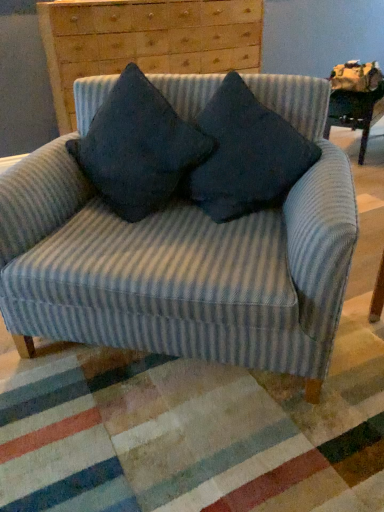
The width and height of the screenshot is (384, 512). I want to click on blue striped fabric chair at center, so click(x=184, y=259).

This screenshot has height=512, width=384. Describe the element at coordinates (145, 40) in the screenshot. I see `wooden chest of drawers at upper center` at that location.

Locate an element on the screen. The width and height of the screenshot is (384, 512). dark blue fabric pillow at center, which is counted as the first pillow, starting from the left is located at coordinates (138, 148).

Which object is further away from the camera, wooden chest of drawers at upper center or dark blue fabric pillow at center, which is the 1th pillow in right-to-left order?

wooden chest of drawers at upper center is behind.

From the image's perspective, is wooden chest of drawers at upper center located above dark blue fabric pillow at center, positioned as the 2th pillow in left-to-right order?

Correct, wooden chest of drawers at upper center appears higher than dark blue fabric pillow at center, positioned as the 2th pillow in left-to-right order, in the image.

Is wooden chest of drawers at upper center facing towards dark blue fabric pillow at center, positioned as the 2th pillow in left-to-right order?

Yes, wooden chest of drawers at upper center is aimed at dark blue fabric pillow at center, positioned as the 2th pillow in left-to-right order.

From the image's perspective, which is above, wooden chest of drawers at upper center or blue striped fabric chair at center?

wooden chest of drawers at upper center, from the image's perspective.

Visually, is wooden chest of drawers at upper center positioned to the left or to the right of blue striped fabric chair at center?

Based on their positions, wooden chest of drawers at upper center is located to the left of blue striped fabric chair at center.

Considering the relative sizes of wooden chest of drawers at upper center and blue striped fabric chair at center in the image provided, is wooden chest of drawers at upper center wider than blue striped fabric chair at center?

Incorrect, the width of wooden chest of drawers at upper center does not surpass that of blue striped fabric chair at center.

Can you tell me how much wooden chest of drawers at upper center and blue striped fabric chair at center differ in facing direction?

The angle between the facing direction of wooden chest of drawers at upper center and the facing direction of blue striped fabric chair at center is 40.5 degrees.

How much distance is there between dark blue fabric pillow at center, the 2th pillow viewed from the right, and blue striped fabric chair at center?

dark blue fabric pillow at center, the 2th pillow viewed from the right, and blue striped fabric chair at center are 9.29 inches apart from each other.

Is point (147, 205) closer or farther from the camera than point (42, 224)?

Point (147, 205) is farther from the camera than point (42, 224).

From a real-world perspective, relative to blue striped fabric chair at center, is dark blue fabric pillow at center, which is counted as the first pillow, starting from the left, vertically above or below?

From a real-world perspective, dark blue fabric pillow at center, which is counted as the first pillow, starting from the left, is physically above blue striped fabric chair at center.

Between dark blue fabric pillow at center, which is counted as the first pillow, starting from the left, and blue striped fabric chair at center, which one appears on the left side from the viewer's perspective?

From the viewer's perspective, dark blue fabric pillow at center, which is counted as the first pillow, starting from the left, appears more on the left side.

Can you confirm if blue striped fabric chair at center is bigger than dark blue fabric pillow at center, which is counted as the first pillow, starting from the left?

Yes, blue striped fabric chair at center is bigger than dark blue fabric pillow at center, which is counted as the first pillow, starting from the left.

Considering the positions of objects blue striped fabric chair at center and dark blue fabric pillow at center, which is counted as the first pillow, starting from the left, in the image provided, who is more to the right, blue striped fabric chair at center or dark blue fabric pillow at center, which is counted as the first pillow, starting from the left,?

Positioned to the right is blue striped fabric chair at center.

Can you confirm if blue striped fabric chair at center is shorter than dark blue fabric pillow at center, which is counted as the first pillow, starting from the left?

Incorrect, the height of blue striped fabric chair at center does not fall short of that of dark blue fabric pillow at center, which is counted as the first pillow, starting from the left.

Considering the positions of points (311, 283) and (187, 127), is point (311, 283) farther from camera compared to point (187, 127)?

No, it is not.

From a real-world perspective, is dark blue fabric pillow at center, the 2th pillow viewed from the right, positioned above or below wooden chest of drawers at upper center?

From a real-world perspective, dark blue fabric pillow at center, the 2th pillow viewed from the right, is physically below wooden chest of drawers at upper center.

Which object is positioned more to the right, dark blue fabric pillow at center, the 2th pillow viewed from the right, or wooden chest of drawers at upper center?

dark blue fabric pillow at center, the 2th pillow viewed from the right.

From the image's perspective, is dark blue fabric pillow at center, the 2th pillow viewed from the right, located beneath wooden chest of drawers at upper center?

Correct, dark blue fabric pillow at center, the 2th pillow viewed from the right, appears lower than wooden chest of drawers at upper center in the image.

I want to click on chest of drawers on the left side of dark blue fabric pillow at center, the 2th pillow viewed from the right, so click(x=145, y=40).

Considering the sizes of objects blue striped fabric chair at center and wooden chest of drawers at upper center in the image provided, who is thinner, blue striped fabric chair at center or wooden chest of drawers at upper center?

With smaller width is wooden chest of drawers at upper center.

From a real-world perspective, is blue striped fabric chair at center below wooden chest of drawers at upper center?

Indeed, from a real-world perspective, blue striped fabric chair at center is positioned beneath wooden chest of drawers at upper center.

Between blue striped fabric chair at center and wooden chest of drawers at upper center, which one has less height?

wooden chest of drawers at upper center is shorter.

Who is more distant, dark blue fabric pillow at center, which is the 1th pillow in right-to-left order, or wooden chest of drawers at upper center?

wooden chest of drawers at upper center.

From a real-world perspective, who is located lower, dark blue fabric pillow at center, positioned as the 2th pillow in left-to-right order, or wooden chest of drawers at upper center?

dark blue fabric pillow at center, positioned as the 2th pillow in left-to-right order.

You are a GUI agent. You are given a task and a screenshot of the screen. Output one action in this format:
    pyautogui.click(x=<x>, y=<y>)
    Task: Click on the pillow that is the 2nd object located below the wooden chest of drawers at upper center (from the image's perspective)
    The height and width of the screenshot is (512, 384).
    Given the screenshot: What is the action you would take?
    pyautogui.click(x=245, y=155)

Find the location of a particular element. chest of drawers that is on the left side of blue striped fabric chair at center is located at coordinates (145, 40).

Estimate the real-world distances between objects in this image. Which object is closer to wooden chest of drawers at upper center, dark blue fabric pillow at center, the 2th pillow viewed from the right, or dark blue fabric pillow at center, positioned as the 2th pillow in left-to-right order?

Among the two, dark blue fabric pillow at center, the 2th pillow viewed from the right, is located nearer to wooden chest of drawers at upper center.

From the image, which object appears to be farther from wooden chest of drawers at upper center, dark blue fabric pillow at center, which is the 1th pillow in right-to-left order, or blue striped fabric chair at center?

The object further to wooden chest of drawers at upper center is dark blue fabric pillow at center, which is the 1th pillow in right-to-left order.

From the image, which object appears to be nearer to dark blue fabric pillow at center, positioned as the 2th pillow in left-to-right order, dark blue fabric pillow at center, the 2th pillow viewed from the right, or blue striped fabric chair at center?

dark blue fabric pillow at center, the 2th pillow viewed from the right, is positioned closer to the anchor dark blue fabric pillow at center, positioned as the 2th pillow in left-to-right order.

Based on their spatial positions, is blue striped fabric chair at center or wooden chest of drawers at upper center closer to dark blue fabric pillow at center, the 2th pillow viewed from the right?

The object closer to dark blue fabric pillow at center, the 2th pillow viewed from the right, is blue striped fabric chair at center.

From the image, which object appears to be farther from wooden chest of drawers at upper center, blue striped fabric chair at center or dark blue fabric pillow at center, the 2th pillow viewed from the right?

→ blue striped fabric chair at center lies further to wooden chest of drawers at upper center than the other object.

When comparing their distances from dark blue fabric pillow at center, which is counted as the first pillow, starting from the left, does dark blue fabric pillow at center, which is the 1th pillow in right-to-left order, or wooden chest of drawers at upper center seem further?

wooden chest of drawers at upper center is positioned further to the anchor dark blue fabric pillow at center, which is counted as the first pillow, starting from the left.

Which object lies further to the anchor point wooden chest of drawers at upper center, dark blue fabric pillow at center, positioned as the 2th pillow in left-to-right order, or dark blue fabric pillow at center, the 2th pillow viewed from the right?

Among the two, dark blue fabric pillow at center, positioned as the 2th pillow in left-to-right order, is located further to wooden chest of drawers at upper center.

Based on their spatial positions, is dark blue fabric pillow at center, which is the 1th pillow in right-to-left order, or dark blue fabric pillow at center, the 2th pillow viewed from the right, closer to blue striped fabric chair at center?

dark blue fabric pillow at center, the 2th pillow viewed from the right.

You are a GUI agent. You are given a task and a screenshot of the screen. Output one action in this format:
    pyautogui.click(x=<x>, y=<y>)
    Task: Click on the pillow between dark blue fabric pillow at center, which is the 1th pillow in right-to-left order, and wooden chest of drawers at upper center from front to back
    The image size is (384, 512).
    Given the screenshot: What is the action you would take?
    pyautogui.click(x=138, y=148)

The image size is (384, 512). Find the location of `pillow between blue striped fabric chair at center and dark blue fabric pillow at center, which is counted as the first pillow, starting from the left, from front to back`. pillow between blue striped fabric chair at center and dark blue fabric pillow at center, which is counted as the first pillow, starting from the left, from front to back is located at coordinates (245, 155).